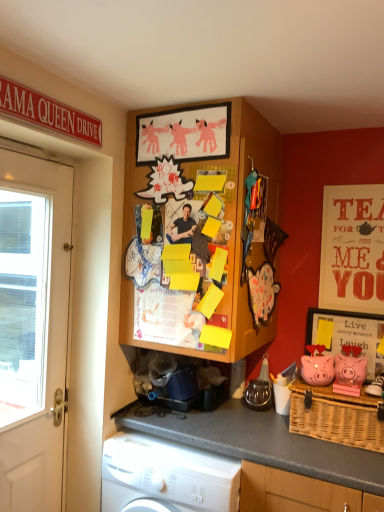
Question: Is wooden board at upper center not inside matte red poster at upper right?

Choices:
 (A) yes
 (B) no

Answer: (A)

Question: Is wooden board at upper center at the left side of matte red poster at upper right?

Choices:
 (A) no
 (B) yes

Answer: (B)

Question: Is matte red poster at upper right completely or partially inside wooden board at upper center?

Choices:
 (A) yes
 (B) no

Answer: (B)

Question: Is wooden board at upper center far from matte red poster at upper right?

Choices:
 (A) no
 (B) yes

Answer: (A)

Question: Does wooden board at upper center have a lesser height compared to matte red poster at upper right?

Choices:
 (A) no
 (B) yes

Answer: (A)

Question: Can you confirm if wooden board at upper center is positioned to the right of matte red poster at upper right?

Choices:
 (A) no
 (B) yes

Answer: (A)

Question: Is white plastic washing machine at lower left facing away from wooden framed picture at right, positioned as the first picture frame in right-to-left order?

Choices:
 (A) yes
 (B) no

Answer: (B)

Question: Considering the relative sizes of white plastic washing machine at lower left and wooden framed picture at right, the first picture frame viewed from the back, in the image provided, is white plastic washing machine at lower left bigger than wooden framed picture at right, the first picture frame viewed from the back,?

Choices:
 (A) yes
 (B) no

Answer: (A)

Question: Is the depth of white plastic washing machine at lower left less than that of wooden framed picture at right, positioned as the first picture frame in right-to-left order?

Choices:
 (A) no
 (B) yes

Answer: (B)

Question: Would you say wooden framed picture at right, placed as the first picture frame when sorted from bottom to top, is part of white plastic washing machine at lower left's contents?

Choices:
 (A) no
 (B) yes

Answer: (A)

Question: Are white plastic washing machine at lower left and wooden framed picture at right, placed as the first picture frame when sorted from bottom to top, beside each other?

Choices:
 (A) yes
 (B) no

Answer: (B)

Question: Is white plastic washing machine at lower left to the left of wooden framed picture at right, the 2th picture frame when ordered from top to bottom, from the viewer's perspective?

Choices:
 (A) yes
 (B) no

Answer: (A)

Question: Is wooden board at upper center thinner than pink matte piggy bank at right, which appears as the first pig when viewed from the right?

Choices:
 (A) yes
 (B) no

Answer: (B)